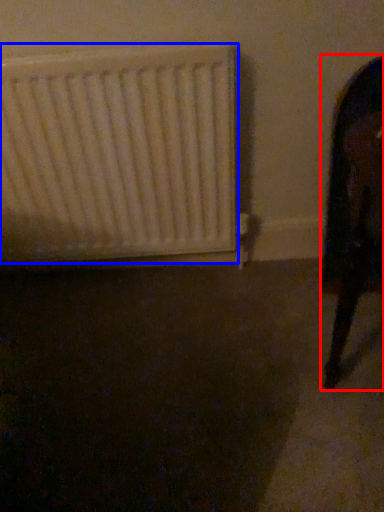
Question: Which object is closer to the camera taking this photo, furniture (highlighted by a red box) or radiator (highlighted by a blue box)?

Choices:
 (A) furniture
 (B) radiator

Answer: (A)